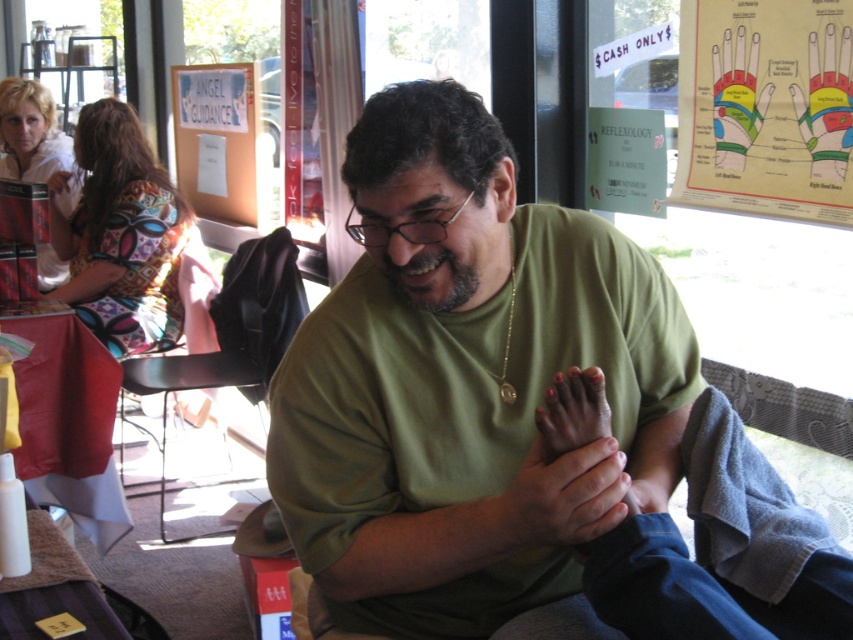
Question: Which object is closer to the camera taking this photo?

Choices:
 (A) smooth skin hands at center
 (B) pink matte nail at center

Answer: (A)

Question: Does smooth skin hands at center appear on the right side of pink matte nail at center?

Choices:
 (A) no
 (B) yes

Answer: (A)

Question: Which point appears farthest from the camera in this image?

Choices:
 (A) (598, 378)
 (B) (560, 502)
 (C) (207, 200)
 (D) (555, 364)

Answer: (C)

Question: Is white paper at upper left further to camera compared to pink matte nail at center?

Choices:
 (A) yes
 (B) no

Answer: (A)

Question: Does smooth skin hands at center have a larger size compared to pink matte nail at center?

Choices:
 (A) yes
 (B) no

Answer: (A)

Question: Which object is closer to the camera taking this photo?

Choices:
 (A) green matte shirt at center
 (B) pink matte nail at center

Answer: (A)